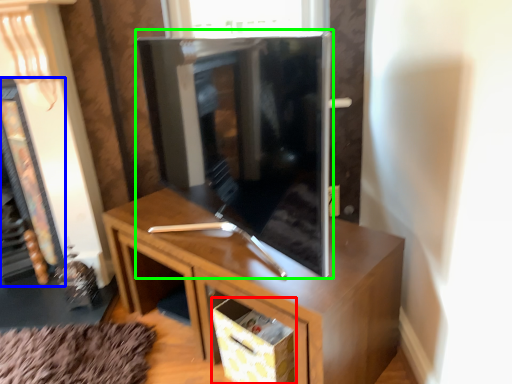
Question: Which is nearer to the drawer (highlighted by a red box)? fireplace (highlighted by a blue box) or tv cabinet (highlighted by a green box).

Choices:
 (A) fireplace
 (B) tv cabinet

Answer: (B)